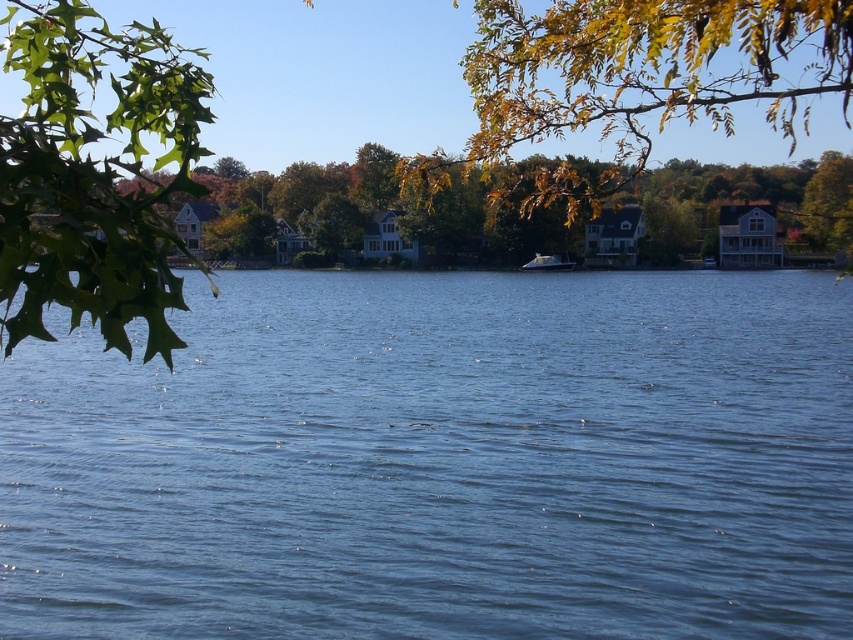
Question: Among these points, which one is farthest from the camera?

Choices:
 (A) (776, 180)
 (B) (181, 163)
 (C) (556, 268)
 (D) (755, 451)

Answer: (A)

Question: Does yellow-green leaves at upper right appear over yellow-green leaves at upper center?

Choices:
 (A) yes
 (B) no

Answer: (A)

Question: Does green leafy branch at upper left have a smaller size compared to yellow-green leaves at upper center?

Choices:
 (A) yes
 (B) no

Answer: (B)

Question: Estimate the real-world distances between objects in this image. Which object is farther from the blue liquid water at center?

Choices:
 (A) white glossy boat at center
 (B) yellow-green leaves at upper center

Answer: (A)

Question: Which of the following is the closest to the observer?

Choices:
 (A) yellow-green leaves at upper right
 (B) blue liquid water at center

Answer: (A)

Question: Where is yellow-green leaves at upper right located in relation to white glossy boat at center in the image?

Choices:
 (A) left
 (B) right

Answer: (B)